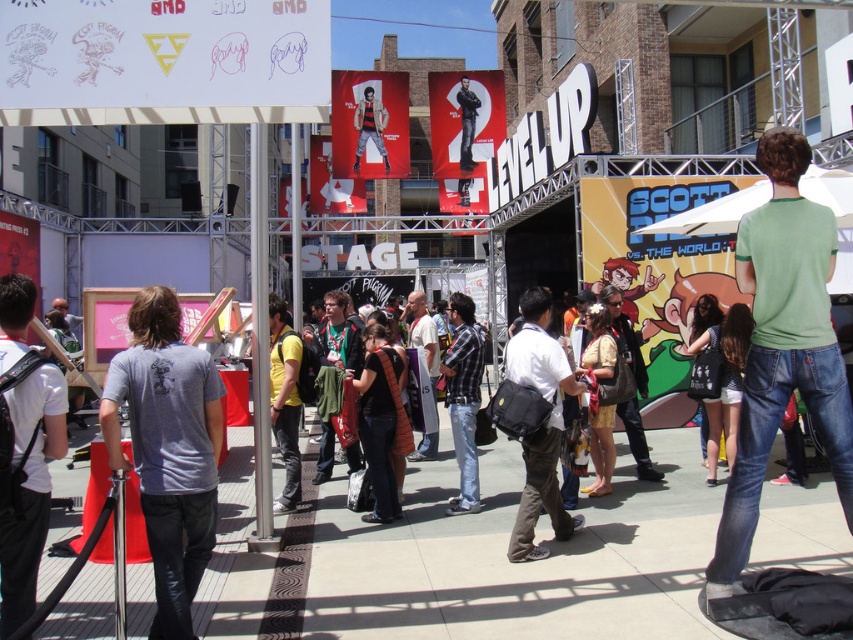
Question: Which point appears closest to the camera in this image?

Choices:
 (A) (662, 625)
 (B) (245, 90)
 (C) (363, 109)

Answer: (B)

Question: Does green cotton t-shirt at right appear over matte red poster at center?

Choices:
 (A) yes
 (B) no

Answer: (B)

Question: Does matte white banner at upper left have a smaller size compared to green fabric jacket at center?

Choices:
 (A) no
 (B) yes

Answer: (B)

Question: Which point appears farthest from the camera in this image?

Choices:
 (A) (373, 108)
 (B) (624, 317)

Answer: (A)

Question: Can you confirm if matte white banner at upper left is smaller than white fabric shirt at center?

Choices:
 (A) no
 (B) yes

Answer: (A)

Question: Which of the following is the farthest from the observer?

Choices:
 (A) (440, 209)
 (B) (815, 320)
 (C) (415, 317)
 (D) (221, 417)

Answer: (A)